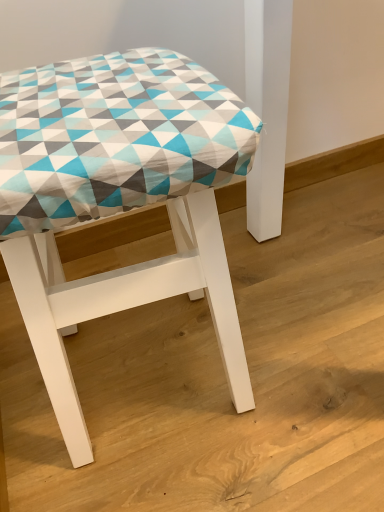
Find the location of a particular element. free spot above matte fabric stool at center (from a real-world perspective) is located at coordinates pyautogui.click(x=89, y=89).